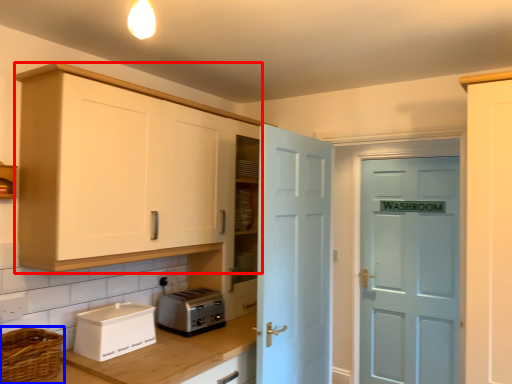
Question: Which object is closer to the camera taking this photo, cabinetry (highlighted by a red box) or basket (highlighted by a blue box)?

Choices:
 (A) cabinetry
 (B) basket

Answer: (B)